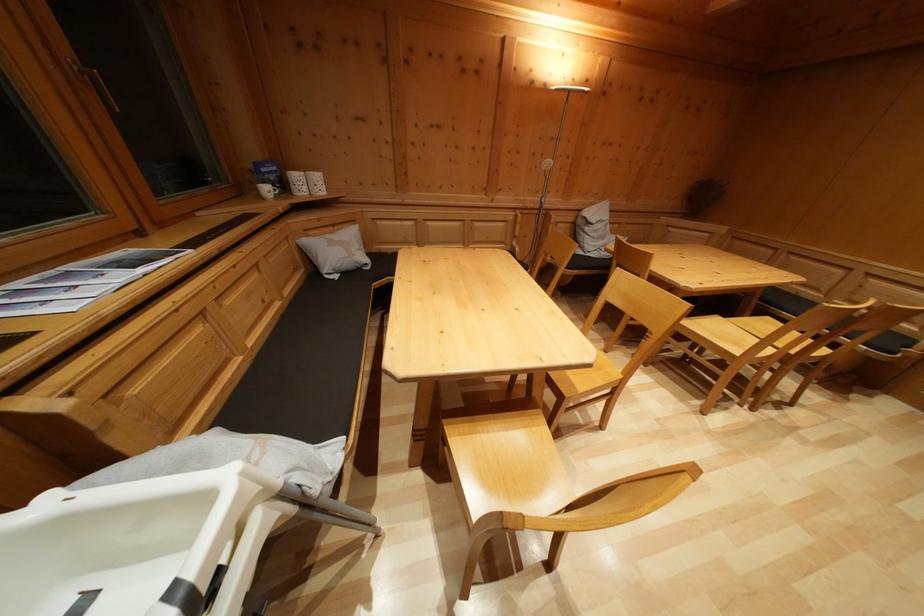
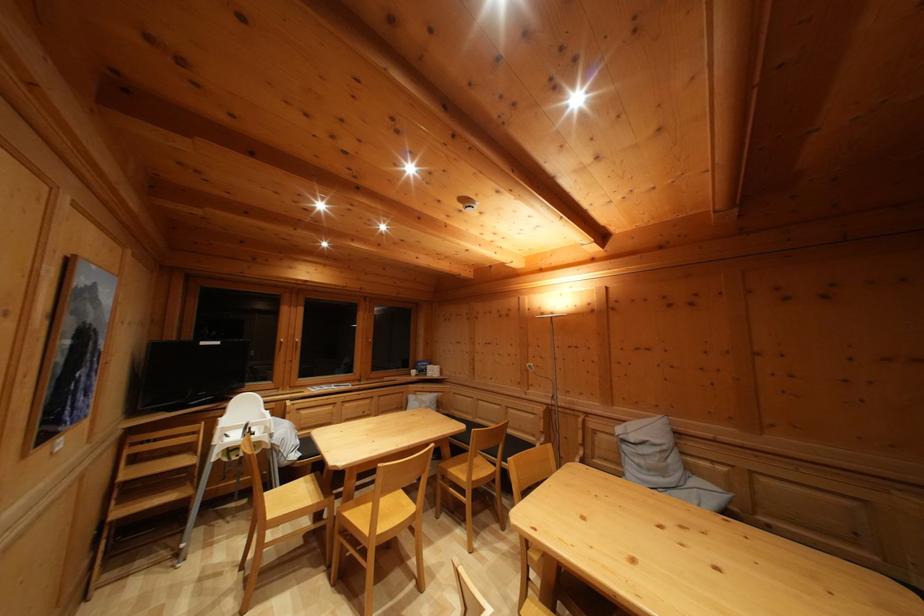
Find the pixel in the second image that matches pixel 273 197 in the first image.

(419, 379)